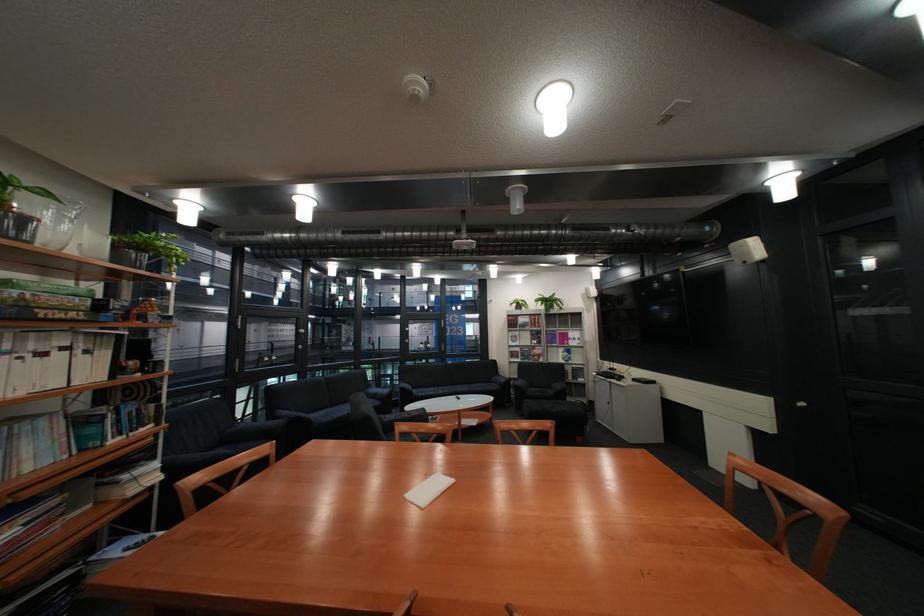
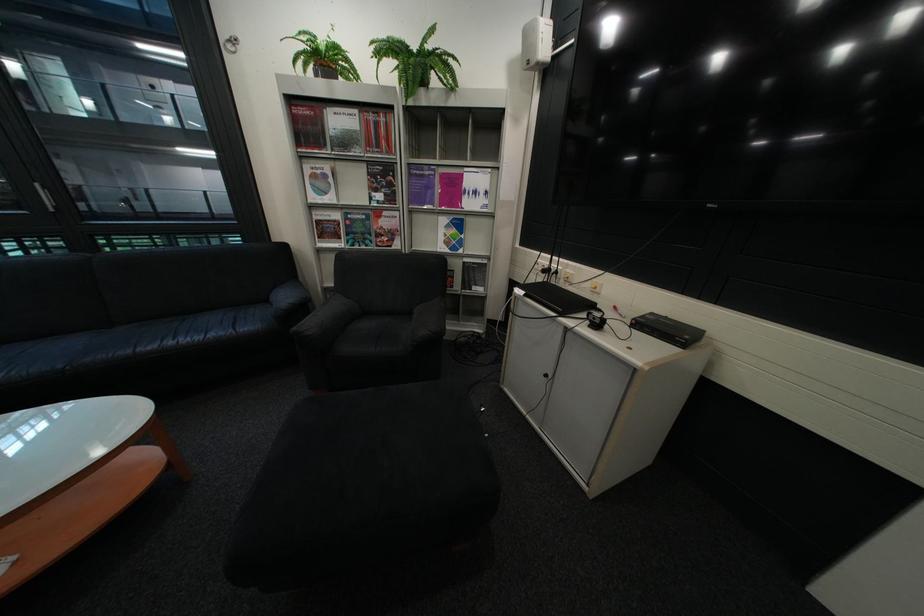
Locate, in the second image, the point that corresponds to pixel 527 328 in the first image.

(322, 147)